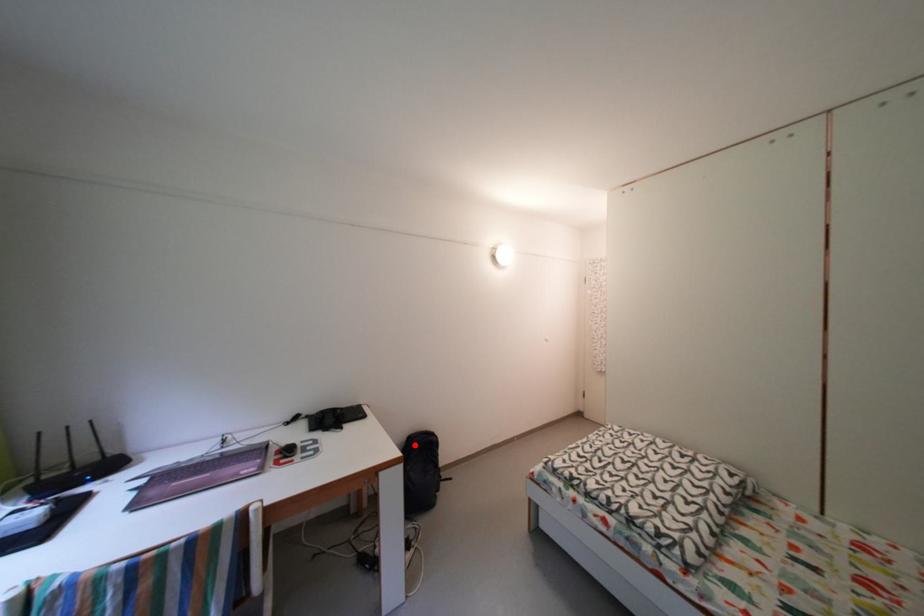
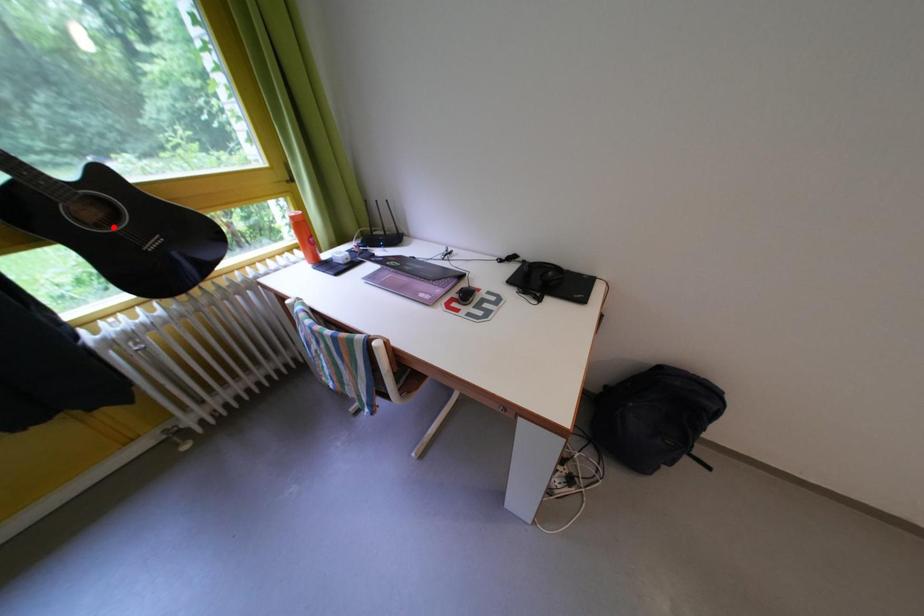
I am providing you with two images of the same scene from different viewpoints. A red point is marked on the first image and another point is marked on the second image. Is the red point in image1 aligned with the point shown in image2?

No